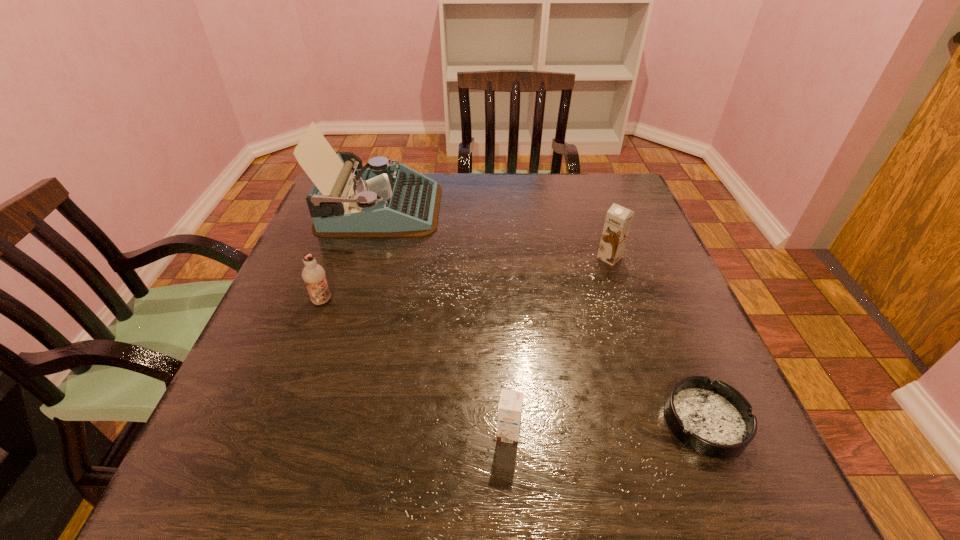
I want to click on vacant space that's between the third farthest object and the farthest chocolate milk, so click(x=466, y=279).

Find the location of a particular element. empty location between the shortest object and the third nearest object is located at coordinates (514, 361).

Identify the location of free spot between the third object from right to left and the shortest object. This screenshot has width=960, height=540. (607, 428).

I want to click on free spot between the farthest object and the second farthest object, so click(x=494, y=233).

Identify the location of blank region between the rightmost chocolate milk and the shortest chocolate milk. The image size is (960, 540). (559, 346).

Where is `vacant space that is in between the shortest object and the third nearest object`? vacant space that is in between the shortest object and the third nearest object is located at coordinates (514, 361).

The width and height of the screenshot is (960, 540). What are the coordinates of `object that is the fourth closest one to the fourth nearest object` in the screenshot? It's located at (313, 274).

Locate an element on the screen. The image size is (960, 540). object that ranks as the fourth closest to the tallest object is located at coordinates (712, 418).

I want to click on chocolate milk that is the closest one to the second farthest object, so click(510, 406).

Identify which chocolate milk is the second closest to the second nearest chocolate milk. Please provide its 2D coordinates. Your answer should be formatted as a tuple, i.e. [(x, y)], where the tuple contains the x and y coordinates of a point satisfying the conditions above.

[(618, 220)]